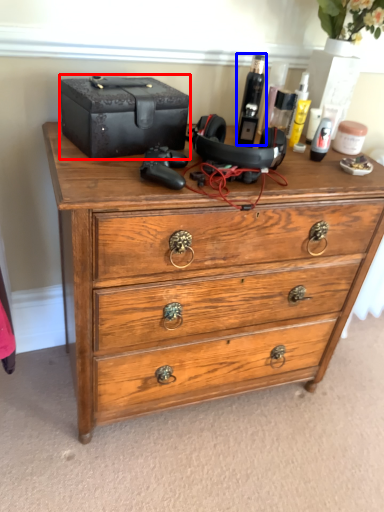
Question: Which object appears closest to the camera in this image, storage box (highlighted by a red box) or toiletry (highlighted by a blue box)?

Choices:
 (A) storage box
 (B) toiletry

Answer: (A)